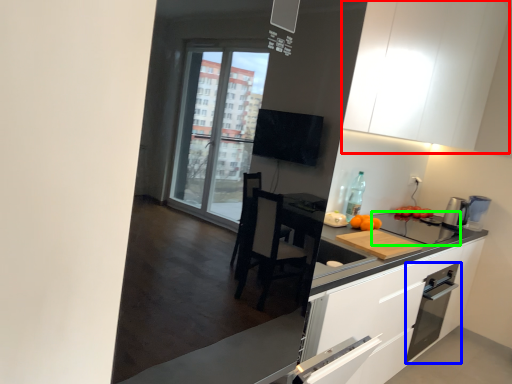
Question: Which is nearer to the cabinetry (highlighted by a red box)? kitchen appliance (highlighted by a blue box) or appliance (highlighted by a green box).

Choices:
 (A) kitchen appliance
 (B) appliance

Answer: (B)